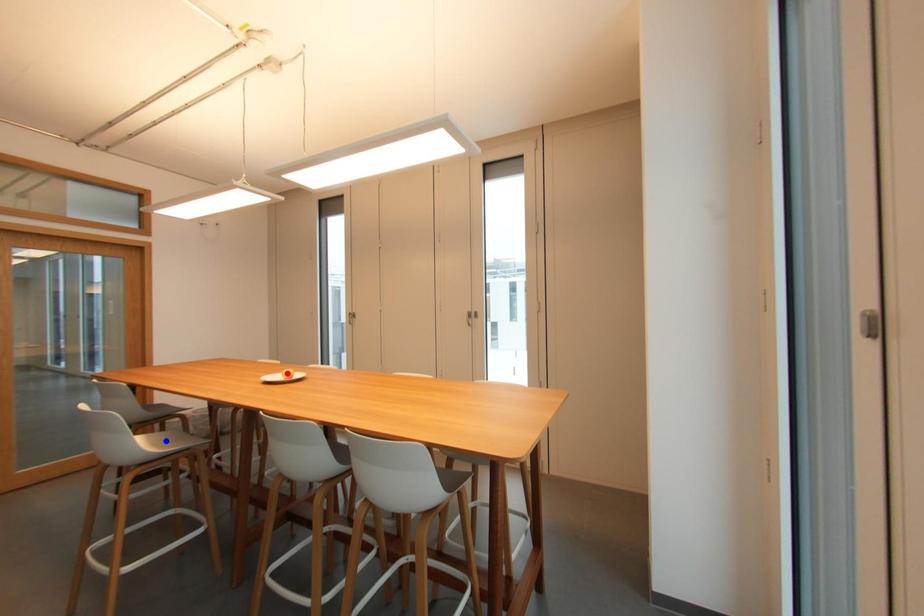
Question: Which of the two points in the image is closer to the camera?

Choices:
 (A) Blue point is closer.
 (B) Red point is closer.

Answer: (A)